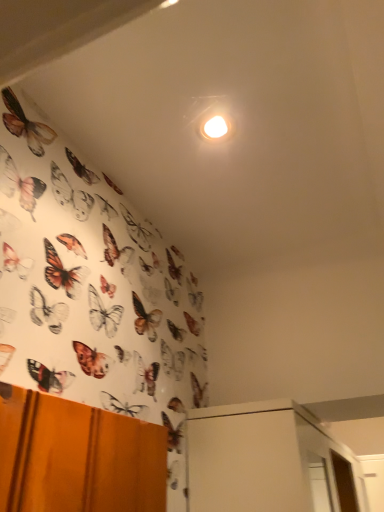
The image size is (384, 512). What do you see at coordinates (269, 461) in the screenshot? I see `white glossy cabinet at lower right` at bounding box center [269, 461].

In order to click on white glossy cabinet at lower right in this screenshot , I will do `click(269, 461)`.

What is the approximate width of white glossy cabinet at lower right?

white glossy cabinet at lower right is 36.81 centimeters in width.

You are a GUI agent. You are given a task and a screenshot of the screen. Output one action in this format:
    pyautogui.click(x=<x>, y=<y>)
    Task: Click on the white glossy cabinet at lower right
    This screenshot has height=512, width=384.
    Given the screenshot: What is the action you would take?
    pyautogui.click(x=269, y=461)